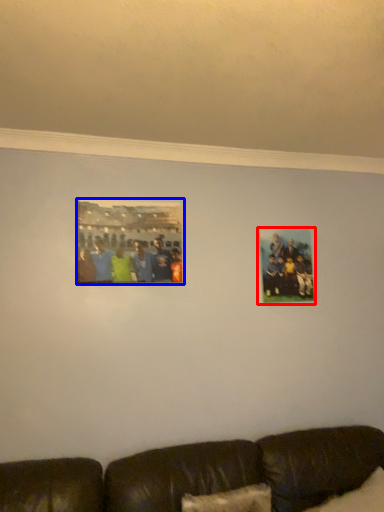
Question: Which object is closer to the camera taking this photo, picture frame (highlighted by a red box) or picture frame (highlighted by a blue box)?

Choices:
 (A) picture frame
 (B) picture frame

Answer: (B)